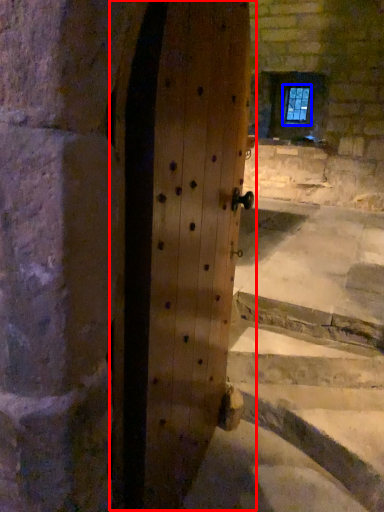
Question: Which of the following is the closest to the observer, door (highlighted by a red box) or window (highlighted by a blue box)?

Choices:
 (A) door
 (B) window

Answer: (A)